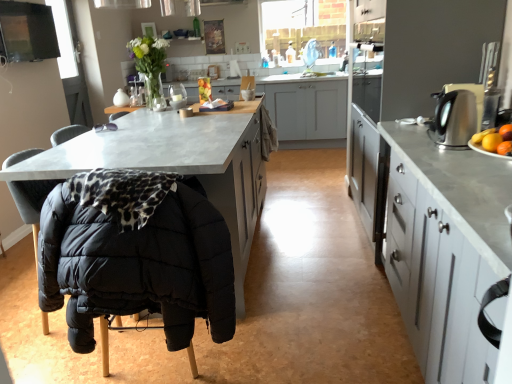
Find the location of `free space in front of satin silver kettle at right`. free space in front of satin silver kettle at right is located at coordinates (443, 157).